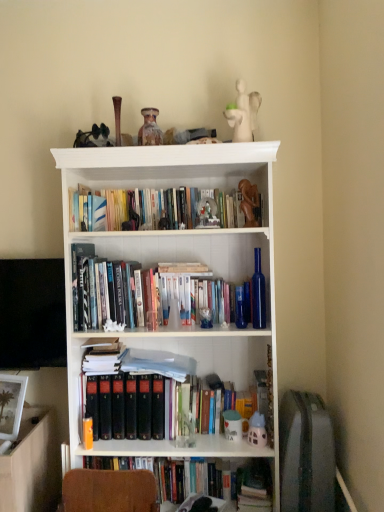
Locate an element on the screen. translucent plastic toy at lower center, the fourth toy positioned from the top is located at coordinates (257, 430).

In the scene shown: Measure the distance between hardcover books at upper center and camera.

hardcover books at upper center and camera are 1.86 meters apart from each other.

What do you see at coordinates (177, 258) in the screenshot? This screenshot has height=512, width=384. I see `white wood bookcase at center` at bounding box center [177, 258].

Find the location of a particular element. The image size is (384, 512). white wood bookcase at center is located at coordinates (177, 258).

In order to face wooden statue at upper center, marked as the third toy in a top-to-bottom arrangement, should I rotate leftwards or rightwards?

To align with it, rotate right about 7.770°.

Image resolution: width=384 pixels, height=512 pixels. I want to click on wooden statue at upper center, arranged as the 2th toy when viewed from the right, so click(249, 202).

Identify the location of translucent plastic toy at lower center, the fifth toy from the left. The image size is (384, 512). (257, 430).

Is wooden statue at upper center, marked as the third toy in a top-to-bottom arrangement, further to camera compared to white matte figurine at upper center, which is the third toy in right-to-left order?

Yes.

Are wooden statue at upper center, marked as the third toy in a top-to-bottom arrangement, and white matte figurine at upper center, positioned as the 5th toy in bottom-to-top order, far apart?

No, there isn't a large distance between wooden statue at upper center, marked as the third toy in a top-to-bottom arrangement, and white matte figurine at upper center, positioned as the 5th toy in bottom-to-top order.

What's the angular difference between wooden statue at upper center, the fourth toy when ordered from left to right, and white matte figurine at upper center, which ranks as the first toy in top-to-bottom order,'s facing directions?

wooden statue at upper center, the fourth toy when ordered from left to right, and white matte figurine at upper center, which ranks as the first toy in top-to-bottom order, are facing 4.02 degrees away from each other.

Who is bigger, wooden statue at upper center, marked as the third toy in a top-to-bottom arrangement, or white matte figurine at upper center, which ranks as the first toy in top-to-bottom order?

white matte figurine at upper center, which ranks as the first toy in top-to-bottom order, is bigger.

Relative to matte white toy at center, the fifth toy in the top-to-bottom sequence, is hardcover books at upper center in front or behind?

Visually, hardcover books at upper center is located behind matte white toy at center, the fifth toy in the top-to-bottom sequence.

From the image's perspective, is hardcover books at upper center located beneath matte white toy at center, arranged as the first toy when ordered from the bottom?

No.

Looking at this image, is hardcover books at upper center aimed at matte white toy at center, the 2th toy from the left?

No, hardcover books at upper center does not turn towards matte white toy at center, the 2th toy from the left.

How many degrees apart are the facing directions of hardcover books at upper center and matte white toy at center, arranged as the first toy when ordered from the bottom?

The angular difference between hardcover books at upper center and matte white toy at center, arranged as the first toy when ordered from the bottom, is 0.963 degrees.

Considering the relative positions of white wood bookcase at center and translucent plastic toy at lower center, the fourth toy positioned from the top, in the image provided, is white wood bookcase at center to the left of translucent plastic toy at lower center, the fourth toy positioned from the top, from the viewer's perspective?

Correct, you'll find white wood bookcase at center to the left of translucent plastic toy at lower center, the fourth toy positioned from the top.

Find the location of a particular element. This screenshot has height=512, width=384. bookcase located above the translucent plastic toy at lower center, the second toy positioned from the bottom (from a real-world perspective) is located at coordinates (177, 258).

From the image's perspective, which one is positioned lower, white wood bookcase at center or translucent plastic toy at lower center, the fifth toy from the left?

translucent plastic toy at lower center, the fifth toy from the left, appears lower in the image.

Which of these two, white wood bookcase at center or translucent plastic toy at lower center, the fifth toy from the left, stands taller?

white wood bookcase at center.

From the image's perspective, which toy is the 2nd one below the speckled ceramic vase at upper center, the 4th toy when ordered from bottom to top? Please provide its 2D coordinates.

[(257, 430)]

Based on their positions, is speckled ceramic vase at upper center, arranged as the 2th toy when viewed from the top, located to the left or right of translucent plastic toy at lower center, marked as the 1th toy in a right-to-left arrangement?

In the image, speckled ceramic vase at upper center, arranged as the 2th toy when viewed from the top, appears on the left side of translucent plastic toy at lower center, marked as the 1th toy in a right-to-left arrangement.

Is speckled ceramic vase at upper center, the 4th toy when ordered from bottom to top, taller or shorter than translucent plastic toy at lower center, the fifth toy from the left?

In the image, speckled ceramic vase at upper center, the 4th toy when ordered from bottom to top, appears to be taller than translucent plastic toy at lower center, the fifth toy from the left.

Which is correct: speckled ceramic vase at upper center, which appears as the 1th toy when viewed from the left, is inside translucent plastic toy at lower center, the fourth toy positioned from the top, or outside of it?

speckled ceramic vase at upper center, which appears as the 1th toy when viewed from the left, lies outside translucent plastic toy at lower center, the fourth toy positioned from the top.

Consider the image. Is translucent plastic toy at lower center, the fourth toy positioned from the top, positioned with its back to matte white toy at center, the 2th toy from the left?

No, matte white toy at center, the 2th toy from the left, is not at the back of translucent plastic toy at lower center, the fourth toy positioned from the top.

Which is more to the right, translucent plastic toy at lower center, the fifth toy from the left, or matte white toy at center, the 4th toy from the right?

translucent plastic toy at lower center, the fifth toy from the left.

The width and height of the screenshot is (384, 512). I want to click on toy beneath the translucent plastic toy at lower center, the fifth toy from the left (from a real-world perspective), so click(232, 425).

From the image's perspective, who appears lower, translucent plastic toy at lower center, marked as the 1th toy in a right-to-left arrangement, or matte white toy at center, the 2th toy from the left?

matte white toy at center, the 2th toy from the left, is shown below in the image.

Is matte white toy at center, the 2th toy from the left, inside or outside of white matte figurine at upper center, acting as the third toy starting from the left?

matte white toy at center, the 2th toy from the left, is not inside white matte figurine at upper center, acting as the third toy starting from the left, it's outside.

Which is more to the right, matte white toy at center, the 2th toy from the left, or white matte figurine at upper center, acting as the third toy starting from the left?

From the viewer's perspective, white matte figurine at upper center, acting as the third toy starting from the left, appears more on the right side.

Does matte white toy at center, the 4th toy from the right, turn towards white matte figurine at upper center, which ranks as the first toy in top-to-bottom order?

No, matte white toy at center, the 4th toy from the right, does not turn towards white matte figurine at upper center, which ranks as the first toy in top-to-bottom order.

Do you think hardcover books at upper center is within white wood bookcase at center, or outside of it?

hardcover books at upper center exists entirely within white wood bookcase at center.

From a real-world perspective, is hardcover books at upper center positioned above or below white wood bookcase at center?

Clearly, from a real-world perspective, hardcover books at upper center is above white wood bookcase at center.

Is hardcover books at upper center wider or thinner than white wood bookcase at center?

hardcover books at upper center is thinner than white wood bookcase at center.

Who is smaller, hardcover books at upper center or white wood bookcase at center?

hardcover books at upper center.

I want to click on the 2nd toy below the white matte figurine at upper center, which is the third toy in right-to-left order (from the image's perspective), so click(x=249, y=202).

You are a GUI agent. You are given a task and a screenshot of the screen. Output one action in this format:
    pyautogui.click(x=<x>, y=<y>)
    Task: Click on the book behind the matte white toy at center, the 4th toy from the right
    The height and width of the screenshot is (512, 384).
    Given the screenshot: What is the action you would take?
    pyautogui.click(x=154, y=210)

Estimate the real-world distances between objects in this image. Which object is further from white matte figurine at upper center, which ranks as the first toy in top-to-bottom order, translucent plastic toy at lower center, the second toy positioned from the bottom, or wooden statue at upper center, marked as the third toy in a top-to-bottom arrangement?

translucent plastic toy at lower center, the second toy positioned from the bottom, is positioned further to the anchor white matte figurine at upper center, which ranks as the first toy in top-to-bottom order.

Based on their spatial positions, is white matte figurine at upper center, positioned as the 5th toy in bottom-to-top order, or translucent plastic toy at lower center, the fifth toy from the left, closer to hardcover books at upper center?

Among the two, white matte figurine at upper center, positioned as the 5th toy in bottom-to-top order, is located nearer to hardcover books at upper center.

In the scene shown: Which object lies nearer to the anchor point speckled ceramic vase at upper center, positioned as the fifth toy in right-to-left order, matte white toy at center, the 2th toy from the left, or wooden statue at upper center, marked as the third toy in a top-to-bottom arrangement?

The object closer to speckled ceramic vase at upper center, positioned as the fifth toy in right-to-left order, is wooden statue at upper center, marked as the third toy in a top-to-bottom arrangement.

When comparing their distances from white wood bookcase at center, does white matte figurine at upper center, positioned as the 5th toy in bottom-to-top order, or translucent plastic toy at lower center, the fifth toy from the left, seem further?

Among the two, translucent plastic toy at lower center, the fifth toy from the left, is located further to white wood bookcase at center.

Which object lies further to the anchor point translucent plastic toy at lower center, the fourth toy positioned from the top, speckled ceramic vase at upper center, positioned as the fifth toy in right-to-left order, or white wood bookcase at center?

speckled ceramic vase at upper center, positioned as the fifth toy in right-to-left order, is positioned further to the anchor translucent plastic toy at lower center, the fourth toy positioned from the top.

Looking at the image, which one is located further to speckled ceramic vase at upper center, positioned as the fifth toy in right-to-left order, translucent plastic toy at lower center, the fifth toy from the left, or wooden statue at upper center, arranged as the third toy when ordered from the bottom?

Based on the image, translucent plastic toy at lower center, the fifth toy from the left, appears to be further to speckled ceramic vase at upper center, positioned as the fifth toy in right-to-left order.

Estimate the real-world distances between objects in this image. Which object is further from wooden statue at upper center, arranged as the third toy when ordered from the bottom, matte white toy at center, arranged as the first toy when ordered from the bottom, or hardcover books at upper center?

Based on the image, matte white toy at center, arranged as the first toy when ordered from the bottom, appears to be further to wooden statue at upper center, arranged as the third toy when ordered from the bottom.

Which object lies further to the anchor point speckled ceramic vase at upper center, positioned as the fifth toy in right-to-left order, translucent plastic toy at lower center, the second toy positioned from the bottom, or hardcover books at upper center?

Based on the image, translucent plastic toy at lower center, the second toy positioned from the bottom, appears to be further to speckled ceramic vase at upper center, positioned as the fifth toy in right-to-left order.

Identify the location of book between white matte figurine at upper center, positioned as the 5th toy in bottom-to-top order, and wooden statue at upper center, the fourth toy when ordered from left to right, from top to bottom. (154, 210).

This screenshot has height=512, width=384. In order to click on toy between hardcover books at upper center and translucent plastic toy at lower center, the second toy positioned from the bottom, from top to bottom in this screenshot , I will do `click(249, 202)`.

In order to click on toy between wooden statue at upper center, arranged as the third toy when ordered from the bottom, and matte white toy at center, the 4th toy from the right, in the up-down direction in this screenshot , I will do `click(257, 430)`.

Find the location of a particular element. This screenshot has height=512, width=384. book between speckled ceramic vase at upper center, the 4th toy when ordered from bottom to top, and white matte figurine at upper center, which ranks as the first toy in top-to-bottom order is located at coordinates (154, 210).